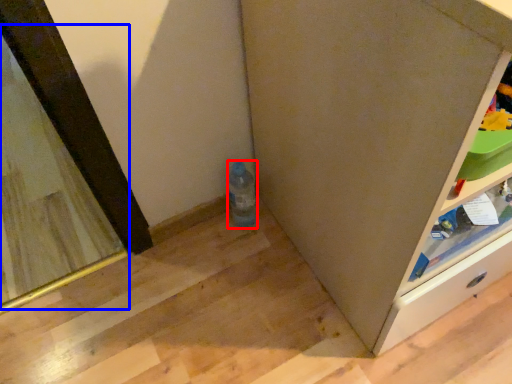
Question: Which object is further to the camera taking this photo, bottle (highlighted by a red box) or mirror (highlighted by a blue box)?

Choices:
 (A) bottle
 (B) mirror

Answer: (B)